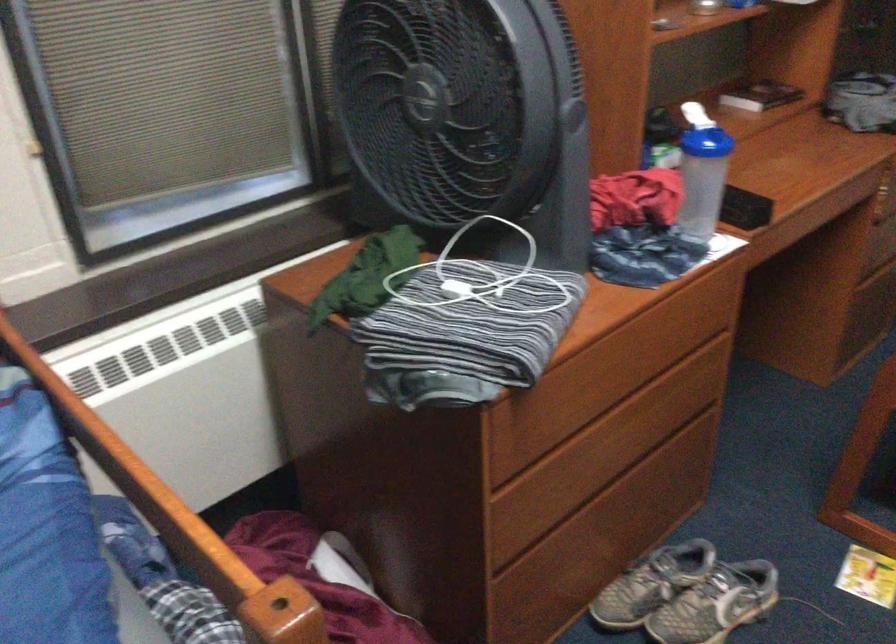
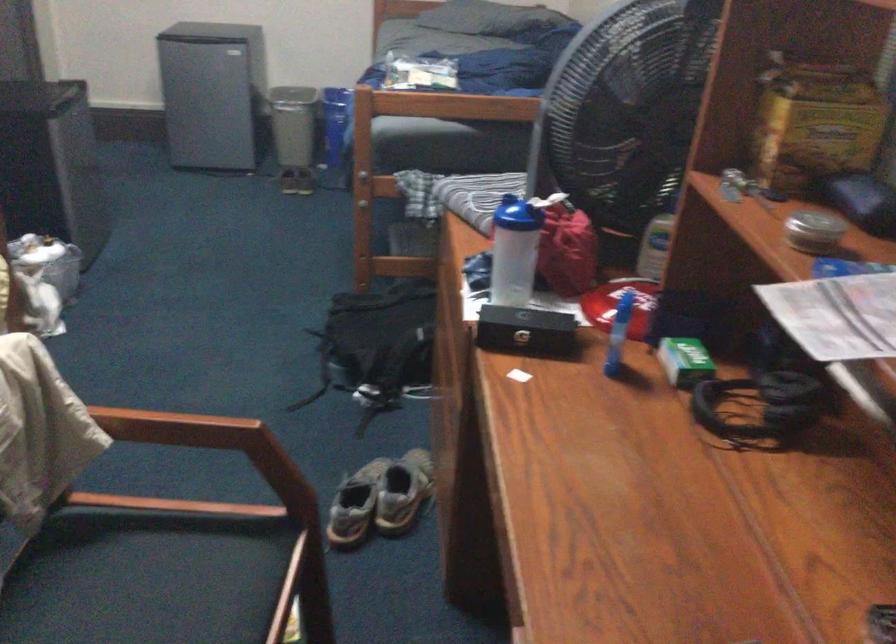
Locate, in the second image, the point that corresponds to pixel 704 172 in the first image.

(513, 251)